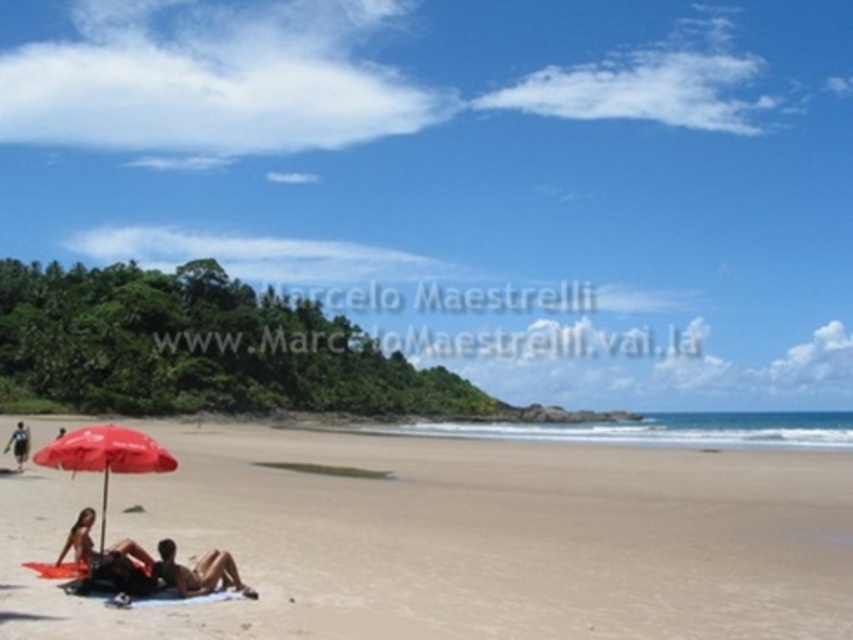
You are a photographer positioned at the edge of the beach, aiming to capture a closeup shot of the matte black bikini at lower left. However, you notice the matte black towel at lower left might block your view. Can you adjust your position to avoid the towel while still focusing on the bikini?

The matte black towel at lower left is larger than the matte black bikini at lower left, so moving slightly to the side or adjusting your angle could help avoid the towel while keeping the bikini in focus.

You are standing at the beach looking towards the ocean. There are two points marked on the sand. The first point is at coordinates point (x=509, y=625) and the second is at point (x=77, y=442). Which point is closer to your current position?

Point (x=509, y=625) is closer to the camera than point (x=77, y=442), so the first point is closer to your current position.

You are a photographer trying to capture the perfect shot of the beach scene. You want to position your camera such that the matte black towel at lower left is centered in the frame. Given the coordinates provided, what adjustment should you make to the camera position to ensure the towel is centered?

The matte black towel at lower left is located at coordinates point (146, 566). To center it in the frame, adjust the camera so the center point aligns with these coordinates.